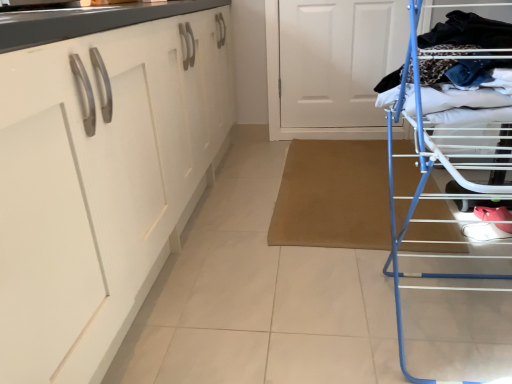
Question: Is white matte door at upper center situated inside white glossy cabinet at left or outside?

Choices:
 (A) outside
 (B) inside

Answer: (A)

Question: From a real-world perspective, relative to white glossy cabinet at left, is white matte door at upper center vertically above or below?

Choices:
 (A) below
 (B) above

Answer: (A)

Question: Which object is the closest to the white glossy cabinet at left?

Choices:
 (A) white matte door at upper center
 (B) blue metal drying rack at right

Answer: (B)

Question: Considering the real-world distances, which object is farthest from the white glossy cabinet at left?

Choices:
 (A) blue metal drying rack at right
 (B) white matte door at upper center

Answer: (B)